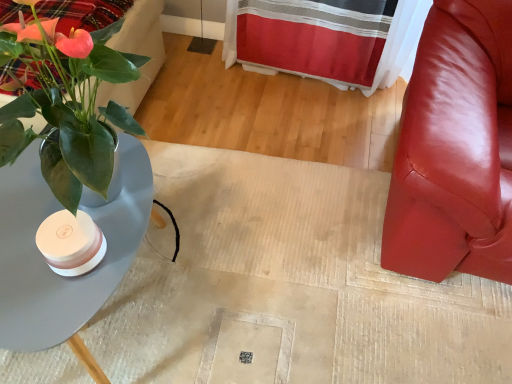
This screenshot has height=384, width=512. Identify the location of velvet plaid bedding at upper left. (83, 12).

This screenshot has width=512, height=384. What are the coordinates of `green glossy plant at left` in the screenshot? It's located at (66, 102).

What is the approximate height of glossy leather chair at right?

It is 86.35 centimeters.

This screenshot has height=384, width=512. What do you see at coordinates (292, 280) in the screenshot?
I see `matte white vase at left` at bounding box center [292, 280].

This screenshot has height=384, width=512. In order to click on matte gray table at left in this screenshot , I will do pyautogui.click(x=47, y=265).

Find the location of a particular element. velvet plaid bedding at upper left is located at coordinates (83, 12).

Consider the image. Which is closer, (x=83, y=6) or (x=181, y=302)?

The point (x=83, y=6) is in front.

From a real-world perspective, who is located higher, velvet plaid bedding at upper left or matte white vase at left?

In real-world perspective, velvet plaid bedding at upper left is above.

Is velvet plaid bedding at upper left beside matte white vase at left?

No.

Could you tell me if velvet plaid bedding at upper left is turned towards matte white vase at left?

No, velvet plaid bedding at upper left does not turn towards matte white vase at left.

From the image's perspective, which is below, matte white vase at left or matte gray table at left?

matte white vase at left.

Is matte white vase at left facing away from matte gray table at left?

No.

The image size is (512, 384). I want to click on table on the left of matte white vase at left, so click(x=47, y=265).

From a real-world perspective, who is located lower, matte gray table at left or glossy leather chair at right?

matte gray table at left, from a real-world perspective.

Based on the photo, from the image's perspective, is matte gray table at left above or below glossy leather chair at right?

matte gray table at left is below glossy leather chair at right.

Which is more to the left, matte gray table at left or glossy leather chair at right?

matte gray table at left is more to the left.

Considering the sizes of objects matte gray table at left and glossy leather chair at right in the image provided, who is wider, matte gray table at left or glossy leather chair at right?

glossy leather chair at right is wider.

Between green glossy plant at left and glossy leather chair at right, which one appears on the left side from the viewer's perspective?

green glossy plant at left.

In terms of height, does green glossy plant at left look taller or shorter compared to glossy leather chair at right?

green glossy plant at left is shorter than glossy leather chair at right.

Considering the relative sizes of green glossy plant at left and glossy leather chair at right in the image provided, is green glossy plant at left wider than glossy leather chair at right?

Indeed, green glossy plant at left has a greater width compared to glossy leather chair at right.

Considering the relative sizes of green glossy plant at left and glossy leather chair at right in the image provided, is green glossy plant at left smaller than glossy leather chair at right?

No.

Which is in front, point (189, 290) or point (82, 134)?

The point (82, 134) is closer.

Is matte white vase at left inside the boundaries of green glossy plant at left, or outside?

matte white vase at left exists outside the volume of green glossy plant at left.

From their relative heights in the image, would you say matte white vase at left is taller or shorter than green glossy plant at left?

Considering their sizes, matte white vase at left has less height than green glossy plant at left.

Between matte white vase at left and green glossy plant at left, which one has larger size?

green glossy plant at left is bigger.

Based on their positions, is glossy leather chair at right located to the left or right of green glossy plant at left?

Clearly, glossy leather chair at right is on the right of green glossy plant at left in the image.

Is glossy leather chair at right in front of or behind green glossy plant at left in the image?

glossy leather chair at right is positioned closer to the viewer than green glossy plant at left.

Who is taller, glossy leather chair at right or green glossy plant at left?

Standing taller between the two is glossy leather chair at right.

Is point (435, 210) positioned behind point (55, 79)?

Yes, point (435, 210) is behind point (55, 79).

Does matte gray table at left turn towards green glossy plant at left?

No, matte gray table at left is not oriented towards green glossy plant at left.

Does point (75, 295) appear closer or farther from the camera than point (104, 159)?

Point (75, 295) is positioned farther from the camera compared to point (104, 159).

From the image's perspective, is matte gray table at left under green glossy plant at left?

Yes, from the image's perspective, matte gray table at left is beneath green glossy plant at left.

How distant is matte gray table at left from green glossy plant at left?

They are 8.87 inches apart.

At what (x,y) coordinates should I click in order to perform the action: click on plain below the velvet plaid bedding at upper left (from the image's perspective). Please return your answer as a coordinate pair (x, y). The height and width of the screenshot is (384, 512). Looking at the image, I should click on (292, 280).

This screenshot has height=384, width=512. I want to click on table that appears above the matte white vase at left (from the image's perspective), so click(x=47, y=265).

Estimate the real-world distances between objects in this image. Which object is further from glossy leather chair at right, matte white vase at left or velvet plaid bedding at upper left?

The object further to glossy leather chair at right is velvet plaid bedding at upper left.

Based on their spatial positions, is glossy leather chair at right or matte white vase at left closer to green glossy plant at left?

matte white vase at left is positioned closer to the anchor green glossy plant at left.

Considering their positions, is matte white vase at left positioned closer to green glossy plant at left than velvet plaid bedding at upper left?

velvet plaid bedding at upper left lies closer to green glossy plant at left than the other object.

Based on their spatial positions, is green glossy plant at left or glossy leather chair at right further from matte gray table at left?

The object further to matte gray table at left is glossy leather chair at right.

Based on their spatial positions, is matte gray table at left or glossy leather chair at right closer to velvet plaid bedding at upper left?

Based on the image, matte gray table at left appears to be nearer to velvet plaid bedding at upper left.

Considering their positions, is matte gray table at left positioned closer to velvet plaid bedding at upper left than green glossy plant at left?

green glossy plant at left is positioned closer to the anchor velvet plaid bedding at upper left.

Based on their spatial positions, is matte gray table at left or green glossy plant at left closer to glossy leather chair at right?

Based on the image, green glossy plant at left appears to be nearer to glossy leather chair at right.

Considering their positions, is green glossy plant at left positioned closer to glossy leather chair at right than velvet plaid bedding at upper left?

green glossy plant at left is closer to glossy leather chair at right.

Locate an element on the screen. Image resolution: width=512 pixels, height=384 pixels. bedding between green glossy plant at left and matte white vase at left in the horizontal direction is located at coordinates (83, 12).

Identify the location of bedding between green glossy plant at left and glossy leather chair at right. The width and height of the screenshot is (512, 384). (83, 12).

Find the location of `table between velvet plaid bedding at upper left and matte white vase at left in the vertical direction`. table between velvet plaid bedding at upper left and matte white vase at left in the vertical direction is located at coordinates (47, 265).

Where is `table between green glossy plant at left and glossy leather chair at right from left to right`? The height and width of the screenshot is (384, 512). table between green glossy plant at left and glossy leather chair at right from left to right is located at coordinates (47, 265).